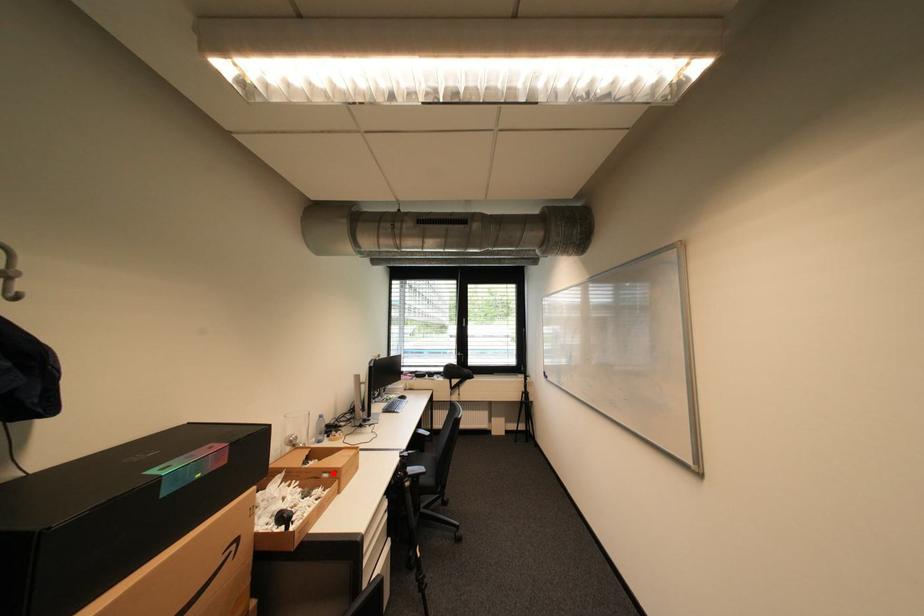
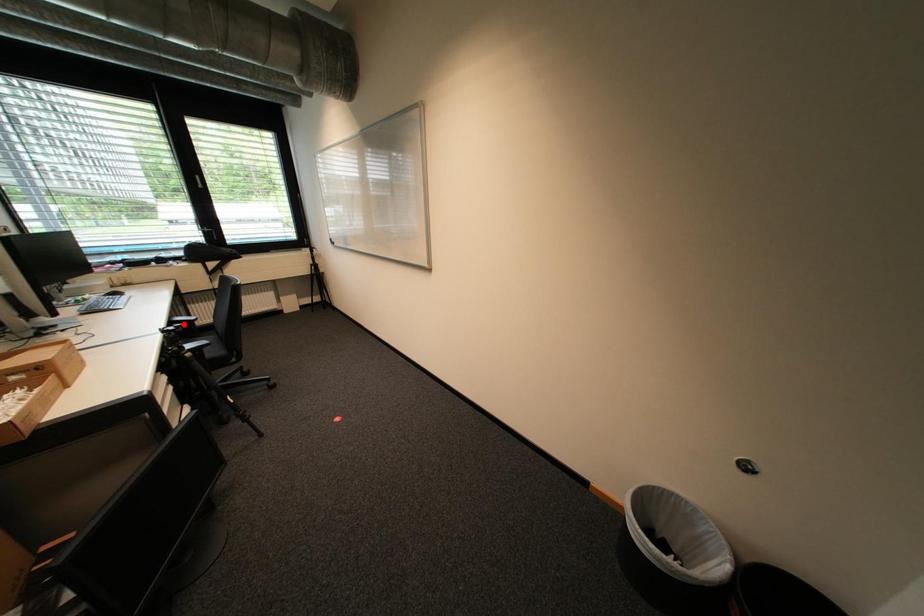
I am providing you with two images of the same scene from different viewpoints. A red point is marked on the first image and another point is marked on the second image. Is the marked point in image1 the same physical position as the marked point in image2?

No